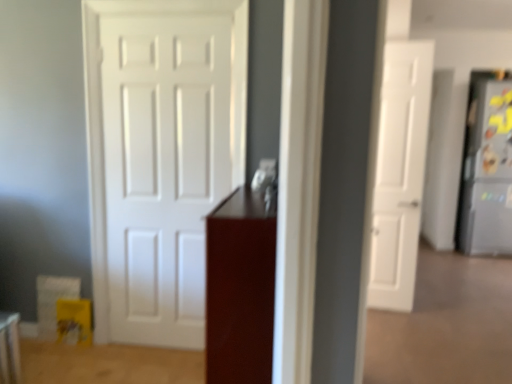
Question: From a real-world perspective, is white matte door at center, positioned as the 1th door in front-to-back order, above or below satin silver refrigerator at right?

Choices:
 (A) below
 (B) above

Answer: (B)

Question: Is white matte door at center, positioned as the 1th door in left-to-right order, wider or thinner than satin silver refrigerator at right?

Choices:
 (A) thin
 (B) wide

Answer: (A)

Question: Which object is positioned farthest from the satin silver refrigerator at right?

Choices:
 (A) white matte door at right, positioned as the first door in right-to-left order
 (B) glossy wood cabinet at center
 (C) white matte door at center, positioned as the 1th door in front-to-back order

Answer: (B)

Question: Which of these objects is positioned closest to the white matte door at right, acting as the first door starting from the back?

Choices:
 (A) white matte door at center, the second door when ordered from back to front
 (B) glossy wood cabinet at center
 (C) satin silver refrigerator at right

Answer: (A)